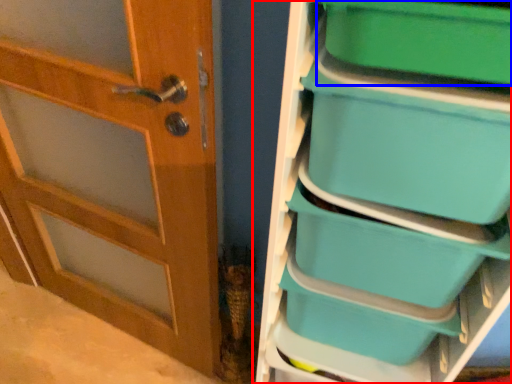
Question: Among these objects, which one is farthest to the camera, shelf (highlighted by a red box) or storage box (highlighted by a blue box)?

Choices:
 (A) shelf
 (B) storage box

Answer: (B)